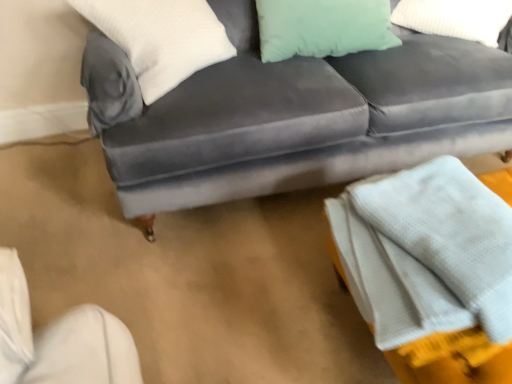
Question: From the image's perspective, is mint green fabric pillow at upper right, arranged as the 1th pillow when viewed from the right, located beneath white soft pillow at upper left, which is the 1th pillow from left to right?

Choices:
 (A) yes
 (B) no

Answer: (B)

Question: Does mint green fabric pillow at upper right, positioned as the 2th pillow in left-to-right order, have a smaller size compared to white soft pillow at upper left, which is the 2th pillow in right-to-left order?

Choices:
 (A) yes
 (B) no

Answer: (A)

Question: Does mint green fabric pillow at upper right, positioned as the 2th pillow in left-to-right order, have a lesser height compared to white soft pillow at upper left, which is the 1th pillow from left to right?

Choices:
 (A) no
 (B) yes

Answer: (B)

Question: Considering the relative sizes of mint green fabric pillow at upper right, positioned as the 2th pillow in left-to-right order, and white soft pillow at upper left, which is the 1th pillow from left to right, in the image provided, is mint green fabric pillow at upper right, positioned as the 2th pillow in left-to-right order, wider than white soft pillow at upper left, which is the 1th pillow from left to right,?

Choices:
 (A) yes
 (B) no

Answer: (B)

Question: From a real-world perspective, is mint green fabric pillow at upper right, positioned as the 2th pillow in left-to-right order, on top of white soft pillow at upper left, which is the 2th pillow in right-to-left order?

Choices:
 (A) yes
 (B) no

Answer: (B)

Question: Would you say mint green fabric pillow at upper right, arranged as the 1th pillow when viewed from the right, is outside white soft pillow at upper left, which is the 1th pillow from left to right?

Choices:
 (A) yes
 (B) no

Answer: (A)

Question: Is white textured blanket at lower right taller than mint green fabric pillow at upper right, positioned as the 2th pillow in left-to-right order?

Choices:
 (A) no
 (B) yes

Answer: (B)

Question: Is white textured blanket at lower right oriented towards mint green fabric pillow at upper right, arranged as the 1th pillow when viewed from the right?

Choices:
 (A) no
 (B) yes

Answer: (A)

Question: Is white textured blanket at lower right in contact with mint green fabric pillow at upper right, arranged as the 1th pillow when viewed from the right?

Choices:
 (A) yes
 (B) no

Answer: (B)

Question: Is white textured blanket at lower right bigger than mint green fabric pillow at upper right, arranged as the 1th pillow when viewed from the right?

Choices:
 (A) no
 (B) yes

Answer: (B)

Question: From the image's perspective, is white textured blanket at lower right above mint green fabric pillow at upper right, positioned as the 2th pillow in left-to-right order?

Choices:
 (A) yes
 (B) no

Answer: (B)

Question: Is white textured blanket at lower right at the left side of mint green fabric pillow at upper right, arranged as the 1th pillow when viewed from the right?

Choices:
 (A) no
 (B) yes

Answer: (B)

Question: Does velvet gray couch at center have a greater height compared to mint green fabric pillow at upper right, arranged as the 1th pillow when viewed from the right?

Choices:
 (A) no
 (B) yes

Answer: (B)